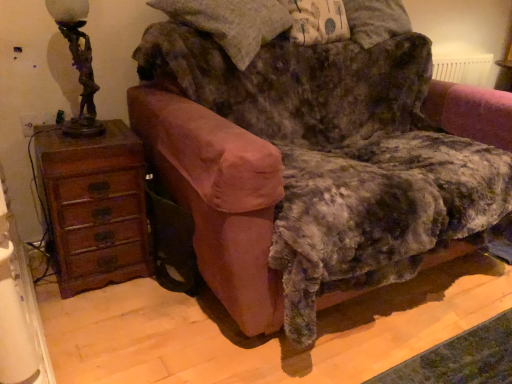
At what (x,y) coordinates should I click in order to perform the action: click on free point below bronze statue-like at left (from a real-world perspective). Please return your answer as a coordinate pair (x, y). Looking at the image, I should click on (83, 128).